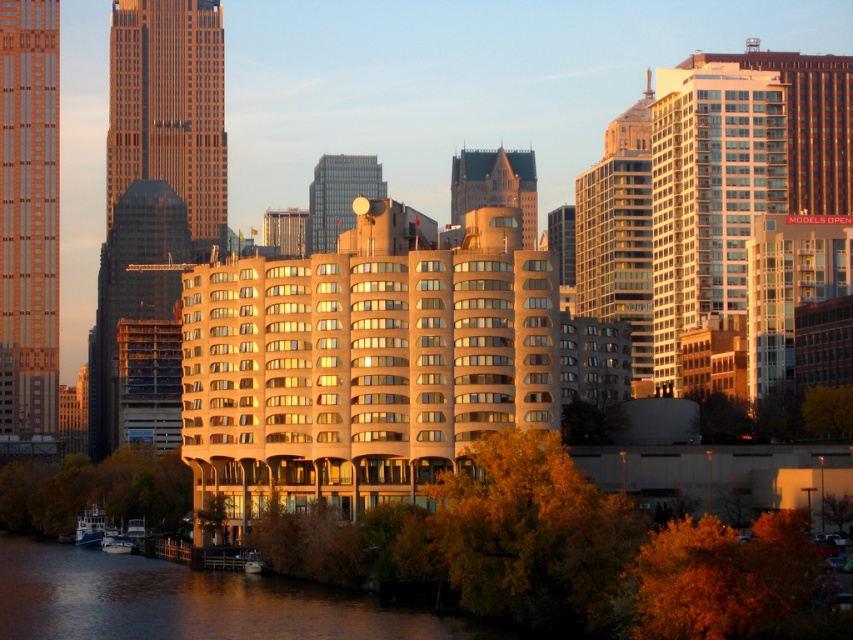
Question: Which object appears closest to the camera in this image?

Choices:
 (A) dark gray stone tower at upper center
 (B) brown water at lower left
 (C) matte glass skyscraper at left
 (D) metallic satellite dish at center

Answer: (B)

Question: Which object appears farthest from the camera in this image?

Choices:
 (A) orange glass skyscraper at center
 (B) dark gray stone tower at upper center

Answer: (B)

Question: Does glassy reflective building at upper right have a greater width compared to brown water at lower left?

Choices:
 (A) no
 (B) yes

Answer: (A)

Question: Is matte glass skyscraper at left in front of glassy reflective building at upper right?

Choices:
 (A) no
 (B) yes

Answer: (A)

Question: Is dark gray stone tower at upper center to the right of metallic satellite dish at center from the viewer's perspective?

Choices:
 (A) yes
 (B) no

Answer: (A)

Question: Which object is positioned farthest from the matte glass skyscraper at left?

Choices:
 (A) dark gray stone tower at upper center
 (B) orange glass skyscraper at center

Answer: (A)